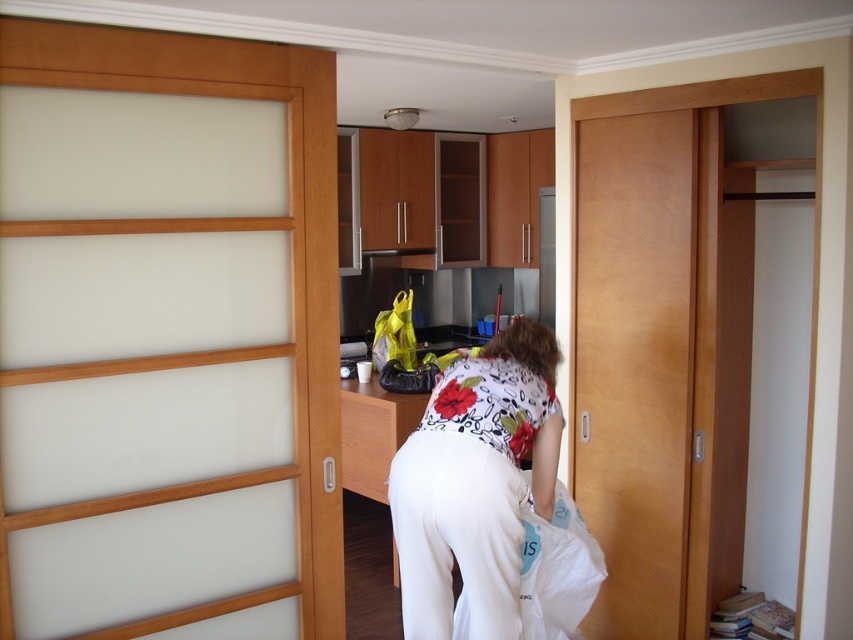
Question: Which point is closer to the camera?

Choices:
 (A) white floral shirt at center
 (B) beech wood door at right

Answer: (A)

Question: Which of the following is the closest to the observer?

Choices:
 (A) (404, 529)
 (B) (619, 554)

Answer: (A)

Question: From the image, what is the correct spatial relationship of beech wood door at right in relation to white floral shirt at center?

Choices:
 (A) left
 (B) right

Answer: (B)

Question: Is beech wood door at right above white floral shirt at center?

Choices:
 (A) yes
 (B) no

Answer: (A)

Question: Does beech wood door at right appear on the right side of white floral shirt at center?

Choices:
 (A) yes
 (B) no

Answer: (A)

Question: Which of the following is the closest to the observer?

Choices:
 (A) white floral shirt at center
 (B) beech wood door at right

Answer: (A)